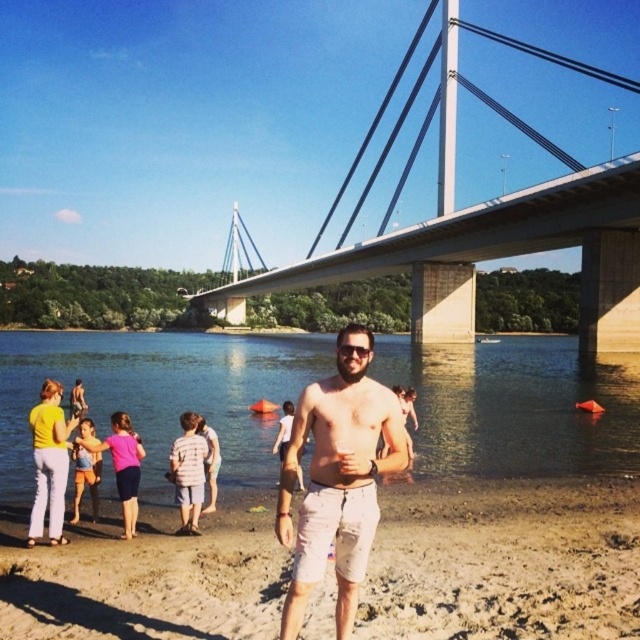
You are a photographer at the riverside beach scene. You need to capture a photo of the pink fabric dress at lower left and light blue denim shorts at lower left. Which object is closer to the bottom edge of the photo?

The pink fabric dress at lower left is positioned under light blue denim shorts at lower left, so it is closer to the bottom edge of the photo.

You are a photographer at the riverside beach scene. You need to decide which clothing item, the pink fabric dress at lower left or the light blue denim shorts at lower left, would be easier to move through the water without getting tangled. Based on their descriptions, which one should you choose?

The pink fabric dress at lower left is thinner than light blue denim shorts at lower left, so the pink fabric dress at lower left would be easier to move through the water without getting tangled because thinner fabrics offer less resistance.